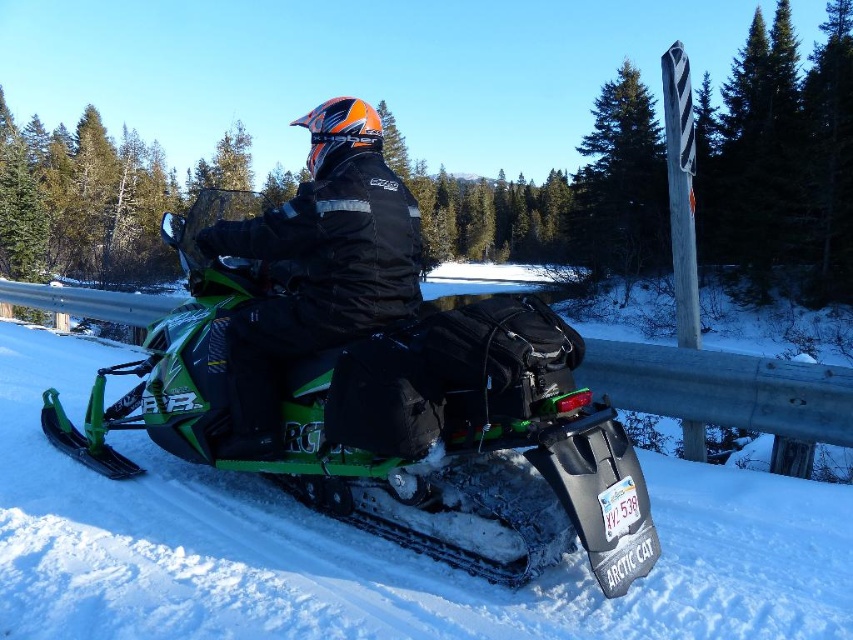
You are a photographer trying to capture a clear photo of the green matte snowmobile at center and the black matte jacket at center. Since you want both objects to be in focus, you need to know their heights. Which object is taller?

The green matte snowmobile at center is taller than the black matte jacket at center.

You are a photographer trying to capture the snowmobile rider. You notice two points in the scene at coordinates point (532,352) and point (390,236). Which point is positioned closer to your camera lens?

Point (532,352) is closer to the viewer than point (390,236).